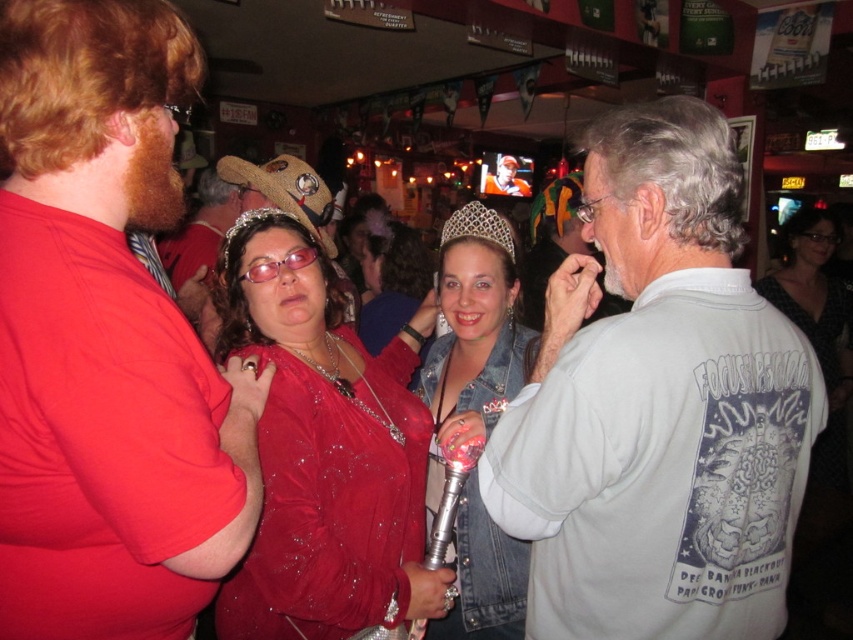
You are standing at the center of the image. There is a point marked at coordinate [659,404]. What object is located at this point?

The point at coordinate [659,404] marks the white cotton shirt at right.

In the party scene at the bar, there is a person wearing a matte red shirt at left and a woman with a sparkly silver tiara at center. From the perspective of someone standing in front of the TV, which object is positioned more to the left?

The matte red shirt at left is positioned to the left of the sparkly silver tiara at center, so from the front of the TV, the matte red shirt at left is more to the left.

You are a photographer at the event and need to capture a group photo of the white cotton shirt at right and the orange fabric shirt at center. Which person should stand behind the other to ensure both are fully visible in the photo?

The white cotton shirt at right should stand behind the orange fabric shirt at center because it is much taller, allowing the shorter orange fabric shirt at center to be fully visible in the photo.